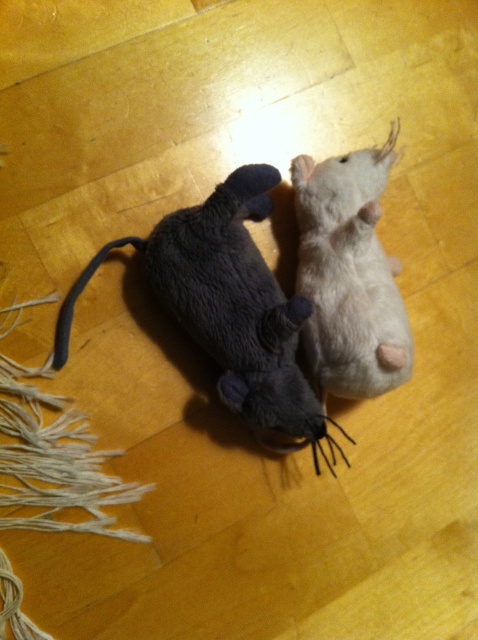
Question: Which point is farther to the camera?

Choices:
 (A) dark gray plush mouse at center
 (B) white soft toy mouse at upper right

Answer: (B)

Question: Can you confirm if dark gray plush mouse at center is thinner than white soft toy mouse at upper right?

Choices:
 (A) no
 (B) yes

Answer: (A)

Question: Which point is farther from the camera taking this photo?

Choices:
 (A) (282, 376)
 (B) (354, 369)

Answer: (A)

Question: Among these points, which one is nearest to the camera?

Choices:
 (A) (321, 317)
 (B) (249, 273)

Answer: (B)

Question: Does dark gray plush mouse at center have a lesser width compared to white soft toy mouse at upper right?

Choices:
 (A) no
 (B) yes

Answer: (A)

Question: Can you confirm if dark gray plush mouse at center is positioned to the left of white soft toy mouse at upper right?

Choices:
 (A) yes
 (B) no

Answer: (A)